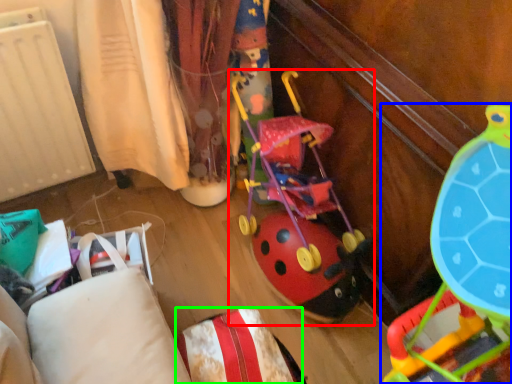
Question: Which object is positioned farthest from toy (highlighted by a red box)? Select from toy (highlighted by a blue box) and pillow (highlighted by a green box).

Choices:
 (A) toy
 (B) pillow

Answer: (B)